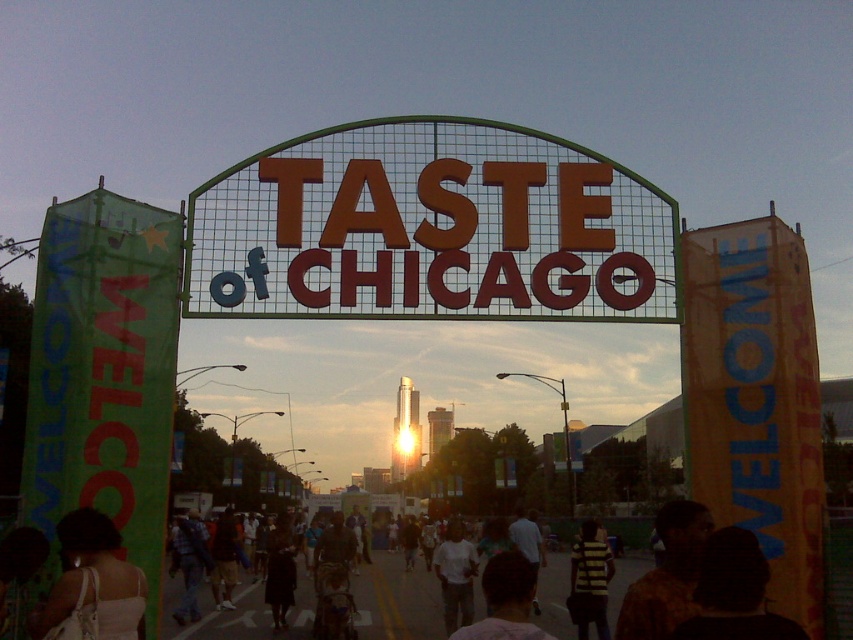
Does metallic gold sign at center have a lesser height compared to dark hair at center?

In fact, metallic gold sign at center may be taller than dark hair at center.

Is point (224, 300) behind point (752, 540)?

No, it is in front of (752, 540).

Find the location of `metallic gold sign at center`. metallic gold sign at center is located at coordinates click(x=430, y=228).

Can you confirm if metallic gold sign at center is taller than white cotton shirt at center?

Yes.

Between metallic gold sign at center and white cotton shirt at center, which one appears on the right side from the viewer's perspective?

white cotton shirt at center is more to the right.

Locate an element on the screen. metallic gold sign at center is located at coordinates (430, 228).

What are the coordinates of `metallic gold sign at center` in the screenshot? It's located at (430, 228).

Can you confirm if dark hair at center is positioned to the right of striped fabric shirt at center?

Indeed, dark hair at center is positioned on the right side of striped fabric shirt at center.

Who is lower down, dark hair at center or striped fabric shirt at center?

striped fabric shirt at center

Describe the element at coordinates (733, 593) in the screenshot. I see `dark hair at center` at that location.

Locate an element on the screen. dark hair at center is located at coordinates (733, 593).